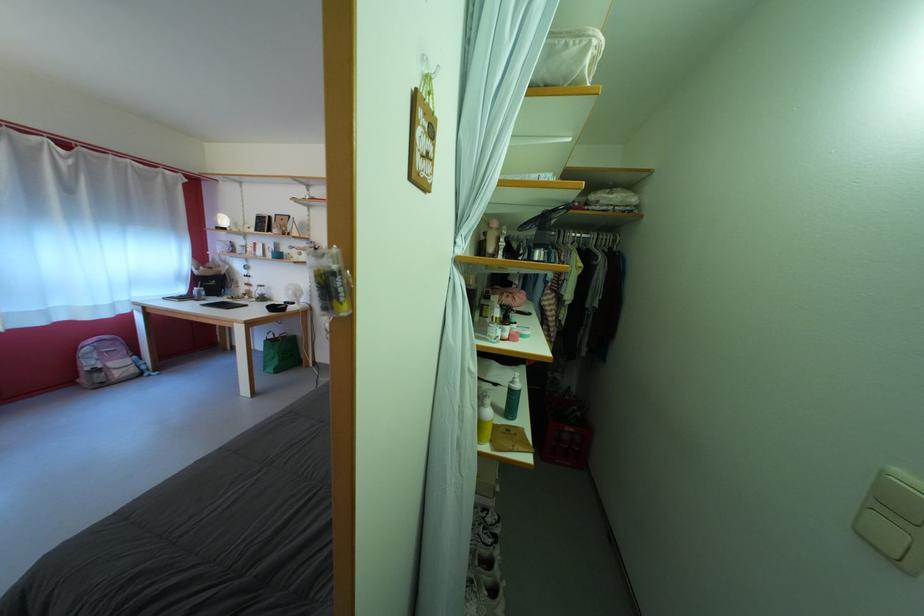
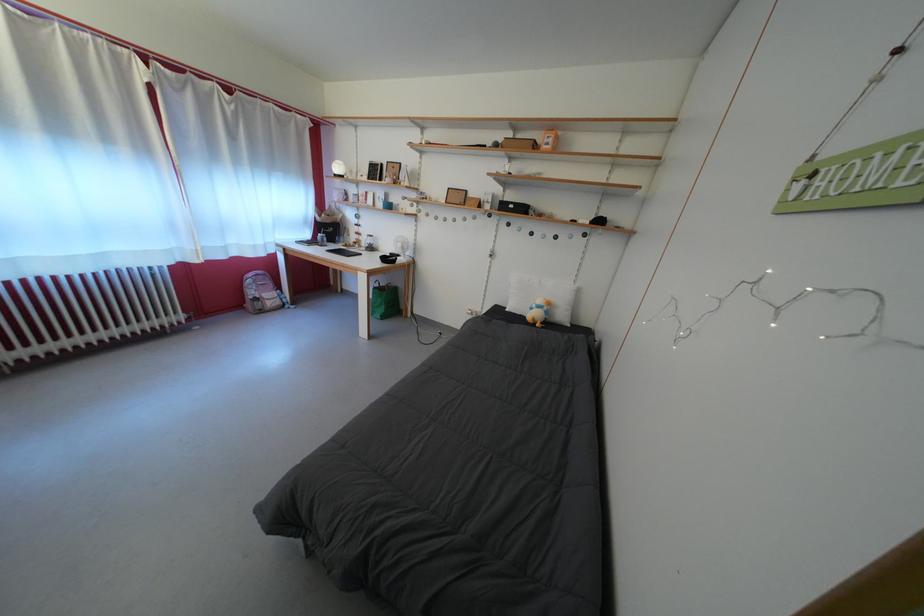
Question: The images are taken continuously from a first-person perspective. In which direction is your viewpoint rotating?

Choices:
 (A) Left
 (B) Right
 (C) Up
 (D) Down

Answer: (A)